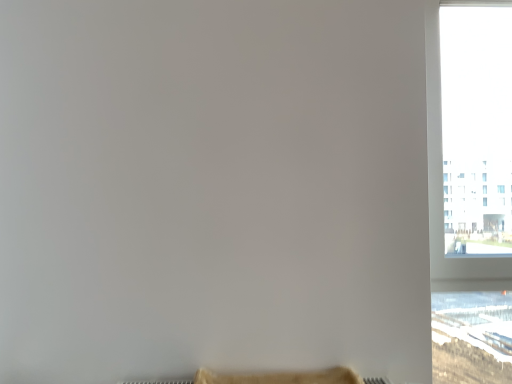
Where is `transparent glass window at right`? The image size is (512, 384). transparent glass window at right is located at coordinates (470, 188).

What do you see at coordinates (470, 188) in the screenshot? I see `transparent glass window at right` at bounding box center [470, 188].

Where is `transparent glass window at right`? transparent glass window at right is located at coordinates (470, 188).